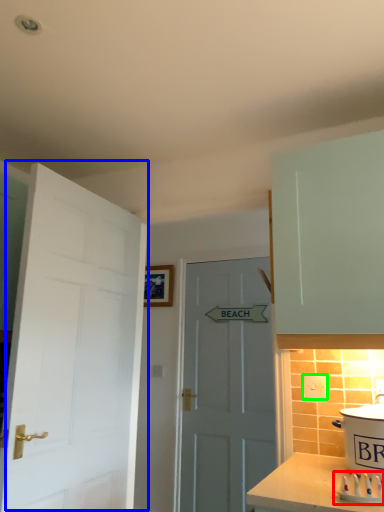
Question: Which object is the closest to the appliance (highlighted by a red box)? Choose among these: door (highlighted by a blue box) or electric outlet (highlighted by a green box).

Choices:
 (A) door
 (B) electric outlet

Answer: (B)